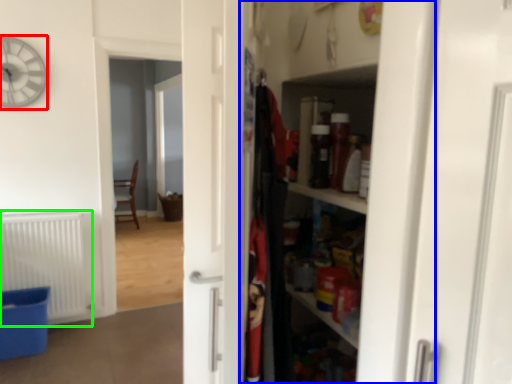
Question: Based on their relative distances, which object is nearer to clock (highlighted by a red box)? Choose from dresser (highlighted by a blue box) and radiator (highlighted by a green box).

Choices:
 (A) dresser
 (B) radiator

Answer: (B)